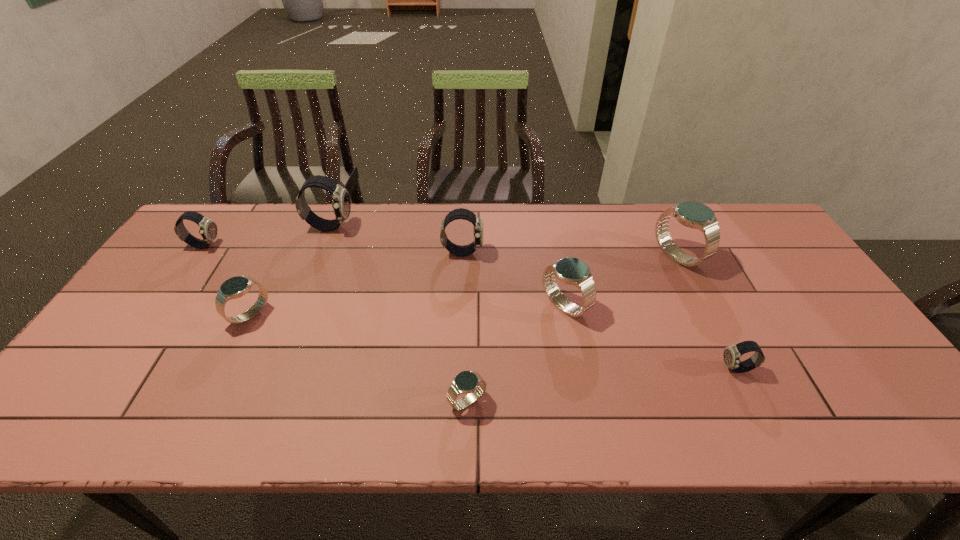
Identify the location of vacant region located on the face of the rightmost dark watch. (587, 369).

Where is `free region located on the face of the rightmost dark watch`? The width and height of the screenshot is (960, 540). free region located on the face of the rightmost dark watch is located at coordinates (654, 369).

At what (x,y) coordinates should I click in order to perform the action: click on vacant area located on the face of the rightmost dark watch. Please return your answer as a coordinate pair (x, y). Looking at the image, I should click on (687, 369).

Locate an element on the screen. The image size is (960, 540). free location located 0.120m on the back of the nearest blue watch is located at coordinates (468, 346).

This screenshot has height=540, width=960. I want to click on object that is at the near edge, so click(x=466, y=382).

What are the coordinates of `object situated at the left edge` in the screenshot? It's located at (208, 229).

The width and height of the screenshot is (960, 540). Identify the location of object present at the far left corner. (208, 229).

In the image, there is a desktop. In order to click on free space at the far edge in this screenshot , I will do `click(331, 204)`.

Locate an element on the screen. free space at the near edge of the desktop is located at coordinates (370, 413).

This screenshot has width=960, height=540. I want to click on free spot at the left edge of the desktop, so click(154, 286).